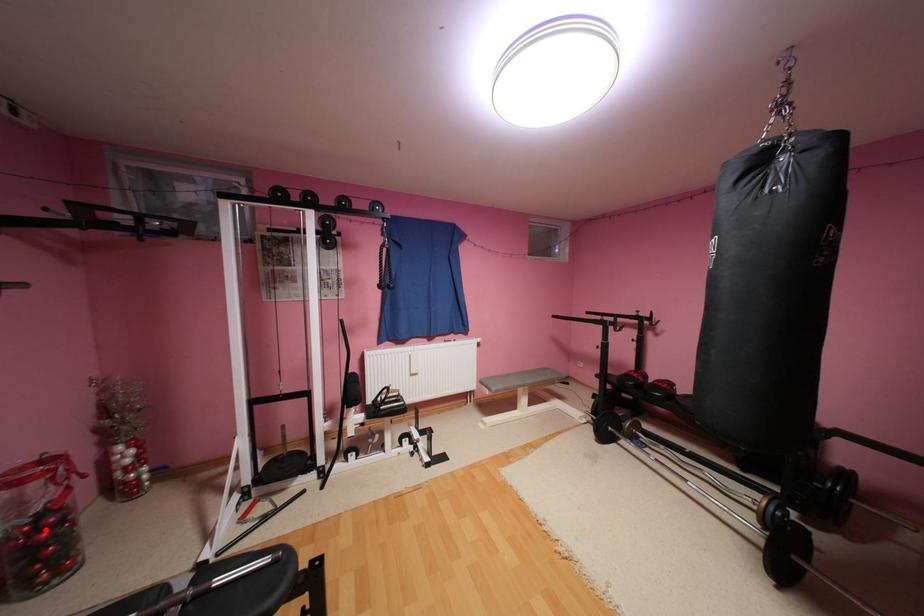
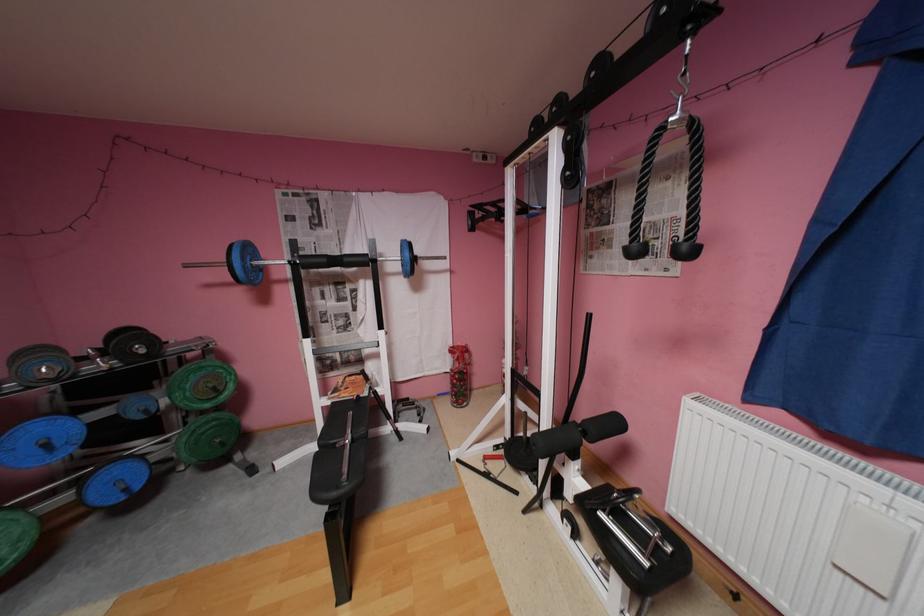
Where in the second image is the point corresponding to the highlighted location from the first image?

(462, 377)